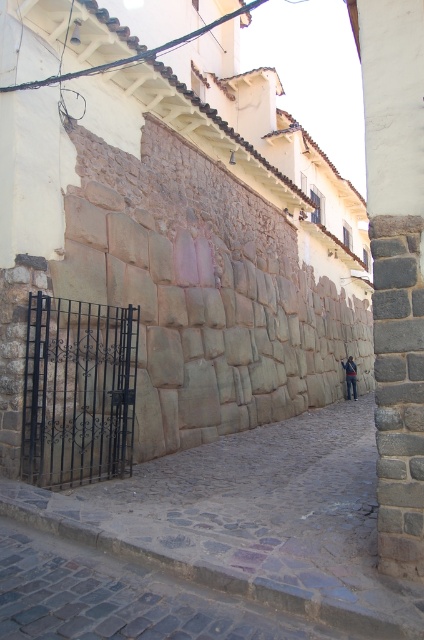
You are a delivery person carrying a package and need to walk through the gray cobblestone alley at center. There are blue denim jeans at center lying on the ground. Can you pass through the alley without stepping on the jeans?

The gray cobblestone alley at center is wider than the blue denim jeans at center, so you can walk through the alley while avoiding stepping on the jeans.

You are standing in the gray cobblestone alley at center and want to walk towards the blue denim jeans at center. Is the path clear for you to move forward?

The gray cobblestone alley at center is in front of blue denim jeans at center, so the path is clear for you to move forward.

In the scene shown: You are standing in front of the gray cobblestone alley at center and want to throw a ball to your friend who is 4 meters away from you. Can you reach your friend by throwing the ball from where you are?

The distance between you and your friend is 4 meters, but the gray cobblestone alley at center is only 3.95 meters away from the viewer. Therefore, the ball can reach your friend as the distance is slightly less than 4 meters.